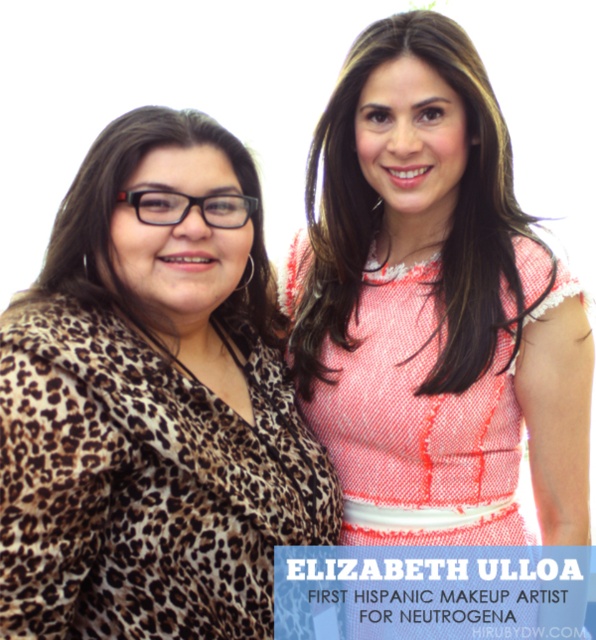
You are a photographer trying to adjust the lighting for a photo shoot. You need to place a spotlight directly above the leopard print coat at left. According to the image coordinates provided, where should you position the spotlight?

The leopard print coat at left is located at coordinates point (153, 403), so the spotlight should be positioned directly above this point to illuminate it properly.

You are a fashion designer observing two outfits in the image. The leopard print coat at left is worn by a woman, and the pink textured dress at center is worn by another. Which outfit is longer in length?

The leopard print coat at left is shorter than the pink textured dress at center, so the pink textured dress at center is longer.

You are standing in front of the image and notice two points marked on it. The first point is at coordinate point (88, 513) and the second is at point (448, 67). Which point is closer to you?

Point (88, 513) is closer to the viewer than point (448, 67).